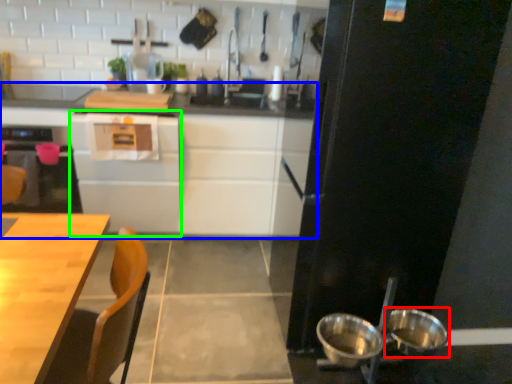
Question: Which object is positioned farthest from bowl (highlighted by a red box)? Select from cabinetry (highlighted by a blue box) and cabinetry (highlighted by a green box).

Choices:
 (A) cabinetry
 (B) cabinetry

Answer: (B)